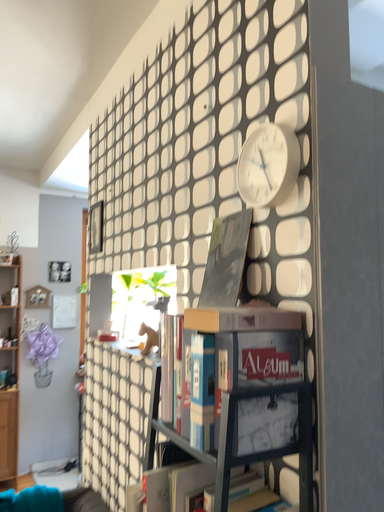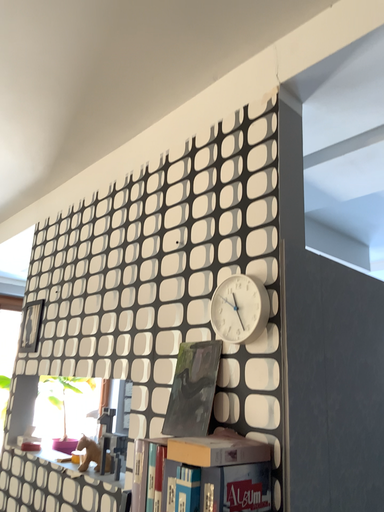
Question: Which way did the camera rotate in the video?

Choices:
 (A) rotated upward
 (B) rotated downward

Answer: (A)